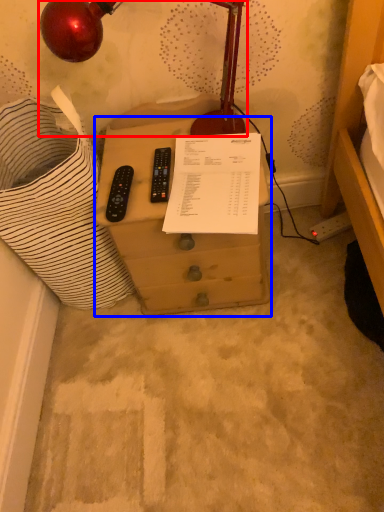
Question: Which object is further to the camera taking this photo, lamp (highlighted by a red box) or furniture (highlighted by a blue box)?

Choices:
 (A) lamp
 (B) furniture

Answer: (B)